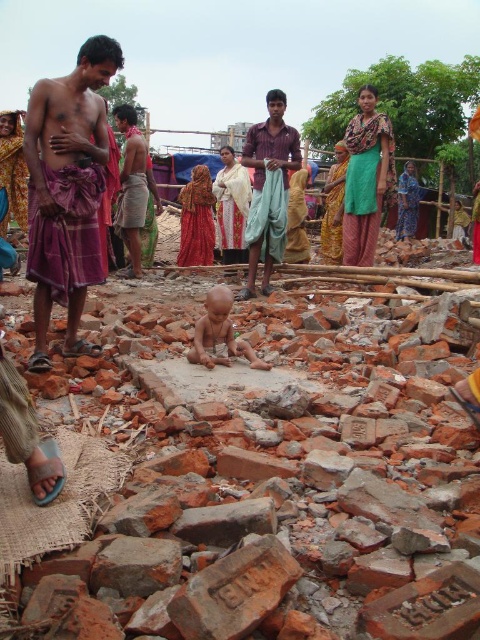
Question: Based on their relative distances, which object is nearer to the brown cotton shirt at center?

Choices:
 (A) matte purple dhoti at center
 (B) light brown skin baby at center
 (C) purple clothed man at left

Answer: (A)

Question: Can you confirm if matte purple dhoti at center is positioned above brown cotton shirt at center?

Choices:
 (A) yes
 (B) no

Answer: (B)

Question: Which is farther from the light brown skin baby at center?

Choices:
 (A) purple clothed man at left
 (B) matte purple dhoti at center

Answer: (B)

Question: Among these objects, which one is nearest to the camera?

Choices:
 (A) light brown skin baby at center
 (B) matte purple dhoti at center

Answer: (A)

Question: Is matte purple dhoti at center to the left of light brown skin baby at center from the viewer's perspective?

Choices:
 (A) no
 (B) yes

Answer: (A)

Question: Is matte purple dhoti at center smaller than light brown skin baby at center?

Choices:
 (A) no
 (B) yes

Answer: (A)